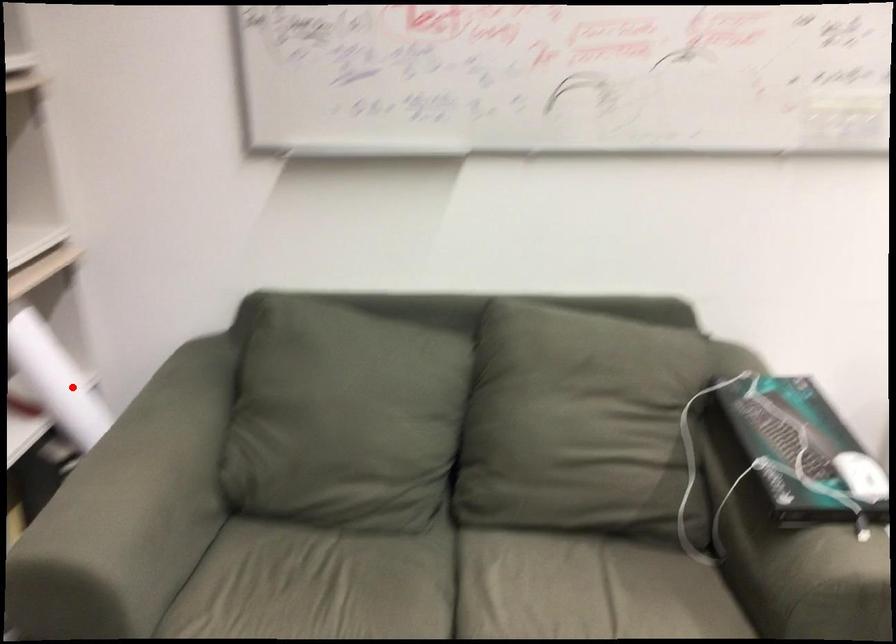
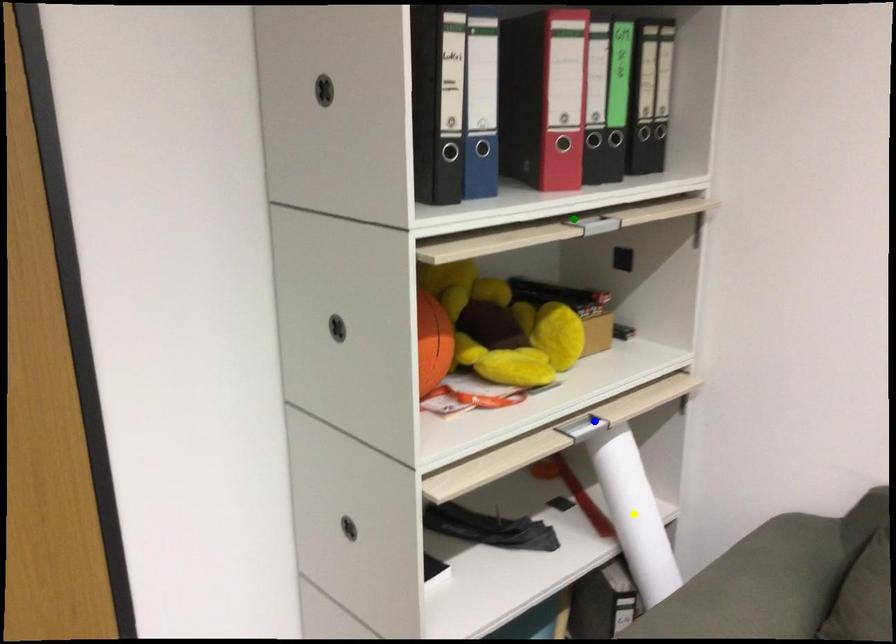
Question: I am providing you with two images of the same scene from different viewpoints. A red point is marked on the first image. You are given multiple points on the second image. Which mark in image 2 goes with the point in image 1?

Choices:
 (A) green point
 (B) blue point
 (C) yellow point

Answer: (C)